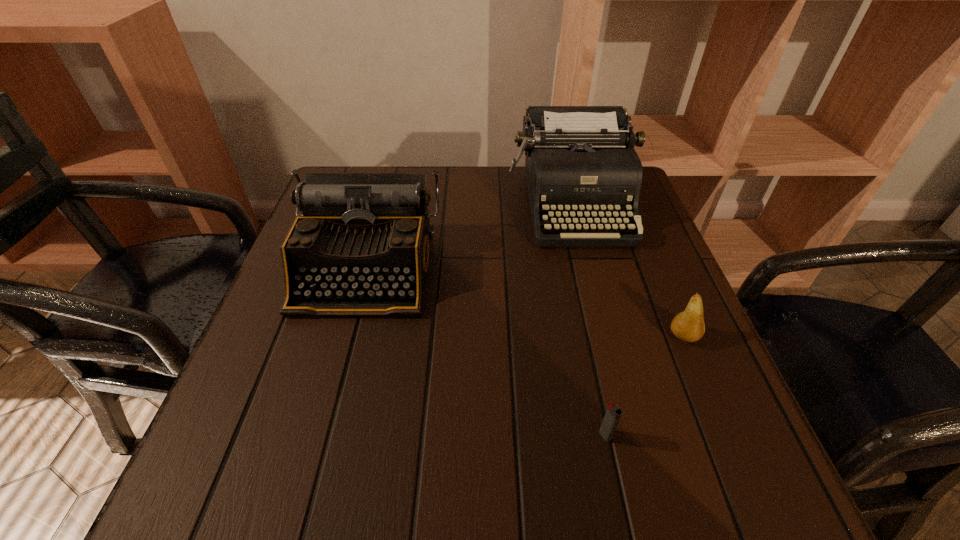
The image size is (960, 540). In order to click on object positioned at the far edge in this screenshot , I will do `click(581, 167)`.

The height and width of the screenshot is (540, 960). In order to click on object at the left edge in this screenshot , I will do `click(361, 246)`.

I want to click on typewriter at the right edge, so click(x=581, y=167).

I want to click on pear present at the right edge, so click(x=688, y=326).

The height and width of the screenshot is (540, 960). I want to click on object at the far right corner, so click(581, 167).

Locate an element on the screen. This screenshot has width=960, height=540. vacant space at the far edge of the desktop is located at coordinates (431, 209).

In the image, there is a desktop. Where is `free space at the near edge`? free space at the near edge is located at coordinates (405, 458).

Where is `vacant space at the left edge of the desktop`? vacant space at the left edge of the desktop is located at coordinates (277, 372).

This screenshot has height=540, width=960. I want to click on blank space at the right edge of the desktop, so click(x=658, y=252).

Find the location of a particular element. free space between the left typewriter and the nearest object is located at coordinates (486, 352).